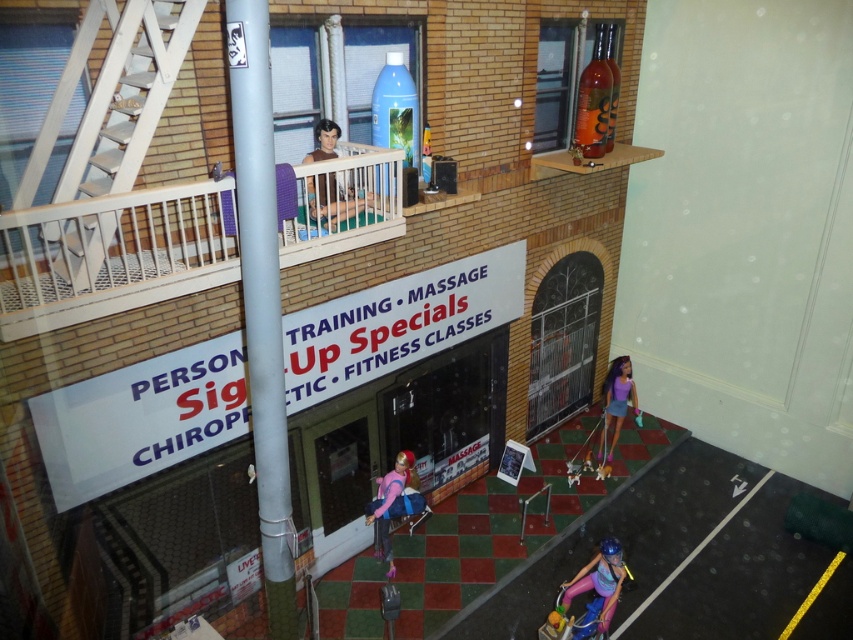
Describe the element at coordinates (335, 200) in the screenshot. I see `smooth brown doll at upper center` at that location.

Does point (335, 196) come closer to viewer compared to point (624, 396)?

That is True.

Locate an element on the screen. smooth brown doll at upper center is located at coordinates (335, 200).

Can you confirm if metallic gray pole at center is bigger than purple fabric doll at lower right?

Indeed, metallic gray pole at center has a larger size compared to purple fabric doll at lower right.

Describe the element at coordinates (260, 298) in the screenshot. I see `metallic gray pole at center` at that location.

Where is `metallic gray pole at center`? This screenshot has height=640, width=853. metallic gray pole at center is located at coordinates (260, 298).

Is the position of pink fabric doll at center less distant than that of smooth brown doll at upper center?

No, it is behind smooth brown doll at upper center.

Does point (412, 486) come farther from viewer compared to point (311, 182)?

Yes, point (412, 486) is farther from viewer.

This screenshot has width=853, height=640. Find the location of `pink fabric doll at center`. pink fabric doll at center is located at coordinates (393, 502).